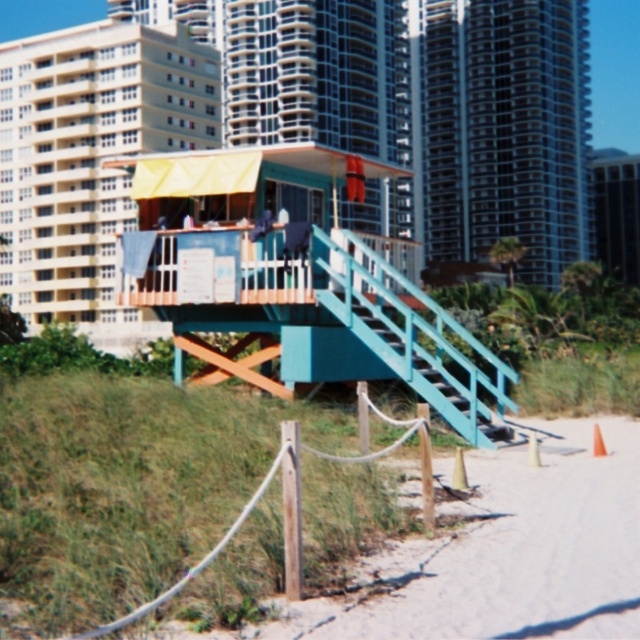
You are a visitor at the beach and want to climb up to the teal wooden lifeguard tower at center. The teal painted wood stairs at center are the only way to reach it. Considering their sizes, will you be able to comfortably climb the stairs to reach the tower?

The teal wooden lifeguard tower at center is larger than the teal painted wood stairs at center, so yes, you can comfortably climb the stairs to reach the tower since the stairs are designed to fit under the larger tower structure.

You are a maintenance worker who needs to move a 10 feet long ladder from the teal painted wood stairs at center to the teal wooden lifeguard tower at center. Can the ladder be moved horizontally without bending or breaking it?

The distance between the teal wooden lifeguard tower at center and the teal painted wood stairs at center is 13.07 feet, which is greater than the ladder length of 10 feet. Therefore, the ladder can be moved horizontally without bending or breaking it.

You are a visitor at the beach and want to climb the teal painted wood stairs at center to reach the lifeguard for assistance. However, you notice the teal wooden lifeguard tower at center is blocking your path. Can you still reach the stairs without going around the tower?

The teal wooden lifeguard tower at center is to the left of the teal painted wood stairs at center, so the tower is not blocking the path to the stairs. You can approach the stairs directly.